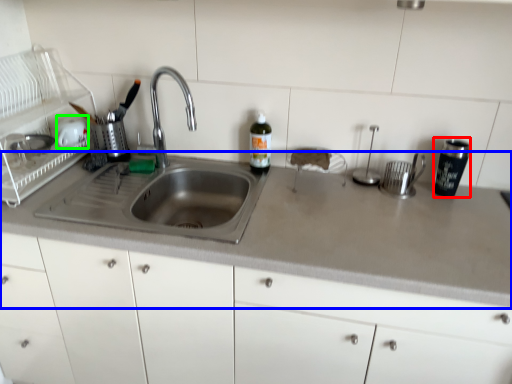
Question: Which object is the farthest from tableware (highlighted by a red box)? Choose among these: countertop (highlighted by a blue box) or appliance (highlighted by a green box).

Choices:
 (A) countertop
 (B) appliance

Answer: (B)